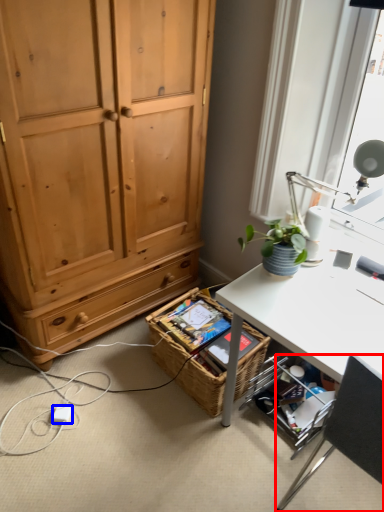
Question: Which point is further to the camera, chair (highlighted by a red box) or power outlet (highlighted by a blue box)?

Choices:
 (A) chair
 (B) power outlet

Answer: (B)